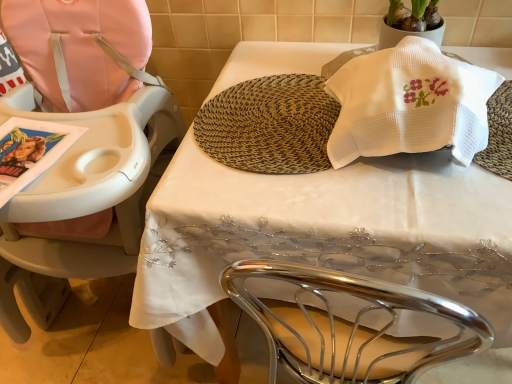
Question: Considering the relative sizes of pink fabric highchair at left and brown woven mat at center in the image provided, is pink fabric highchair at left smaller than brown woven mat at center?

Choices:
 (A) yes
 (B) no

Answer: (B)

Question: Is pink fabric highchair at left at the right side of brown woven mat at center?

Choices:
 (A) no
 (B) yes

Answer: (A)

Question: Does pink fabric highchair at left have a greater width compared to brown woven mat at center?

Choices:
 (A) yes
 (B) no

Answer: (A)

Question: From a real-world perspective, is pink fabric highchair at left positioned over brown woven mat at center based on gravity?

Choices:
 (A) no
 (B) yes

Answer: (A)

Question: Does pink fabric highchair at left appear on the left side of brown woven mat at center?

Choices:
 (A) yes
 (B) no

Answer: (A)

Question: From the image's perspective, relative to white waffle-textured towel at upper right, is brown woven mat at center above or below?

Choices:
 (A) below
 (B) above

Answer: (A)

Question: From a real-world perspective, is brown woven mat at center positioned above or below white waffle-textured towel at upper right?

Choices:
 (A) below
 (B) above

Answer: (A)

Question: From their relative heights in the image, would you say brown woven mat at center is taller or shorter than white waffle-textured towel at upper right?

Choices:
 (A) tall
 (B) short

Answer: (B)

Question: In terms of size, does brown woven mat at center appear bigger or smaller than white waffle-textured towel at upper right?

Choices:
 (A) small
 (B) big

Answer: (A)

Question: Is point (253, 99) positioned closer to the camera than point (137, 278)?

Choices:
 (A) farther
 (B) closer

Answer: (A)

Question: Considering the positions of brown woven mat at center and white embroidered tablecloth at center in the image, is brown woven mat at center bigger or smaller than white embroidered tablecloth at center?

Choices:
 (A) big
 (B) small

Answer: (B)

Question: In terms of height, does brown woven mat at center look taller or shorter compared to white embroidered tablecloth at center?

Choices:
 (A) tall
 (B) short

Answer: (B)

Question: From the image's perspective, relative to white embroidered tablecloth at center, is brown woven mat at center above or below?

Choices:
 (A) above
 (B) below

Answer: (A)

Question: In terms of size, does white waffle-textured towel at upper right appear bigger or smaller than brown woven mat at center?

Choices:
 (A) small
 (B) big

Answer: (B)

Question: In the image, is white waffle-textured towel at upper right positioned in front of or behind brown woven mat at center?

Choices:
 (A) front
 (B) behind

Answer: (A)